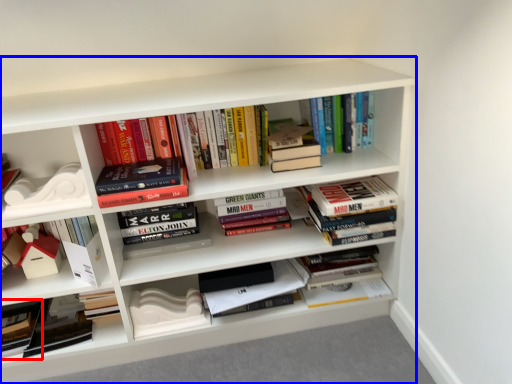
Question: Which of the following is the closest to the observer, paperback book (highlighted by a red box) or shelf (highlighted by a blue box)?

Choices:
 (A) paperback book
 (B) shelf

Answer: (B)